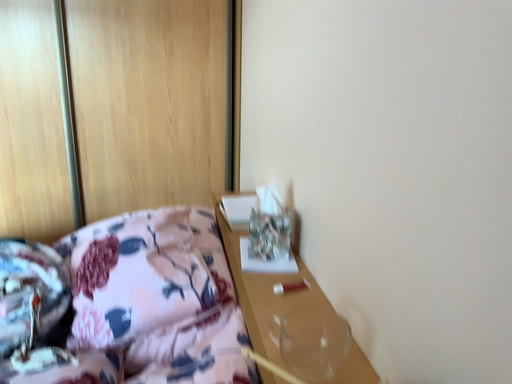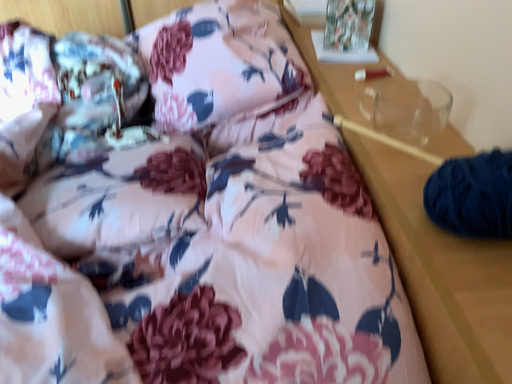
Question: Which way did the camera rotate in the video?

Choices:
 (A) rotated downward
 (B) rotated upward

Answer: (A)